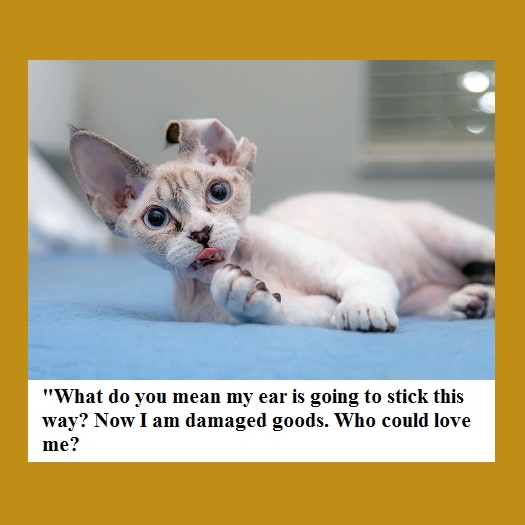
This screenshot has width=525, height=525. I want to click on wall, so click(x=288, y=98).